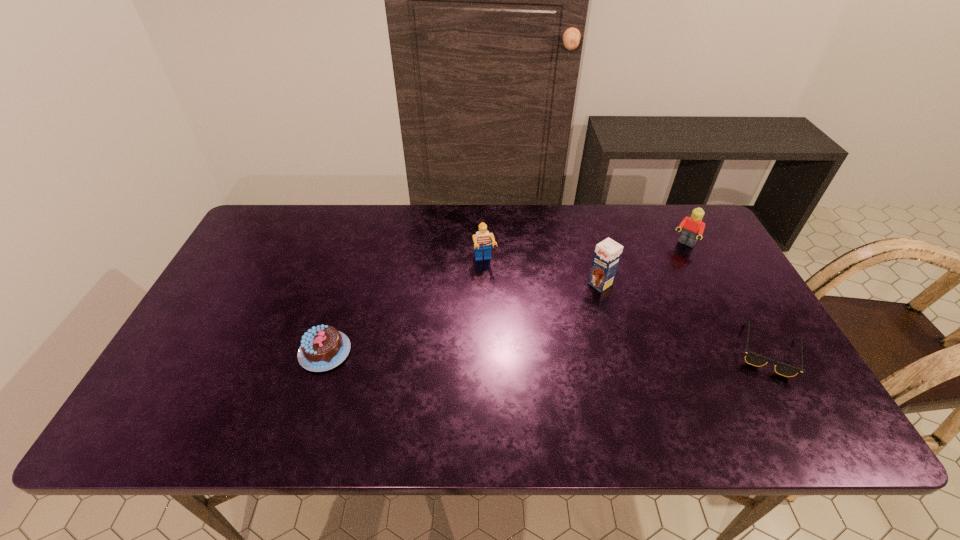
Find the location of `free region located on the face of the fourth object from right to left`. free region located on the face of the fourth object from right to left is located at coordinates (503, 333).

Identify the location of vacant space positioned 0.210m on the face of the fourth object from right to left. The image size is (960, 540). (501, 324).

Where is `blank space located 0.120m on the face of the fourth object from right to left`? The width and height of the screenshot is (960, 540). blank space located 0.120m on the face of the fourth object from right to left is located at coordinates (494, 299).

The height and width of the screenshot is (540, 960). In order to click on vacant space located on the front label of the tallest object in this screenshot , I will do `click(560, 312)`.

Find the location of `vacant point located 0.340m on the front label of the tallest object`. vacant point located 0.340m on the front label of the tallest object is located at coordinates (500, 352).

At what (x,y) coordinates should I click in order to perform the action: click on free space located on the front label of the tallest object. Please return your answer as a coordinate pair (x, y). Looking at the image, I should click on (530, 332).

The height and width of the screenshot is (540, 960). I want to click on vacant position located 0.190m on the face of the farther Lego, so click(655, 284).

The width and height of the screenshot is (960, 540). I want to click on free space located on the face of the farther Lego, so click(622, 325).

At what (x,y) coordinates should I click in order to perform the action: click on vacant space located 0.330m on the face of the farther Lego. Please return your answer as a coordinate pair (x, y). The image size is (960, 540). Looking at the image, I should click on (633, 312).

This screenshot has width=960, height=540. I want to click on object present at the far edge, so click(693, 226).